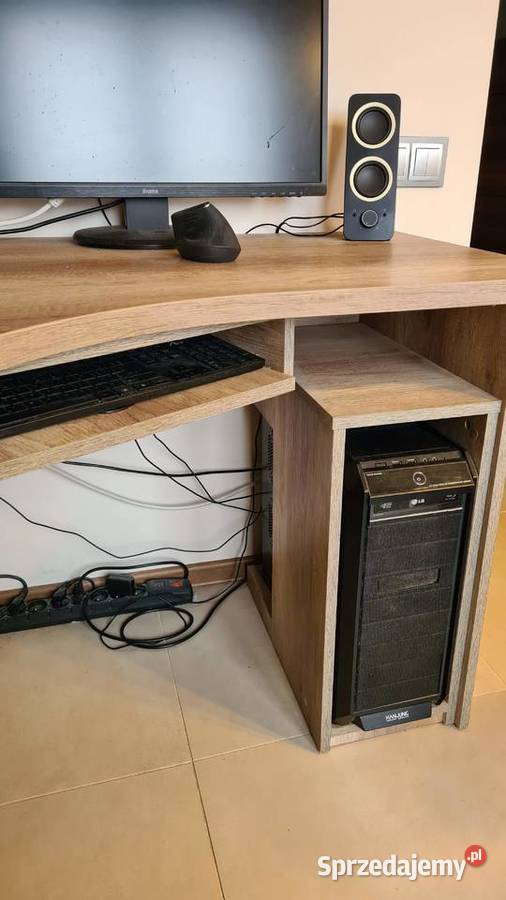
Locate an element on the screen. tile floor is located at coordinates (140, 846), (80, 761), (198, 724), (253, 808).